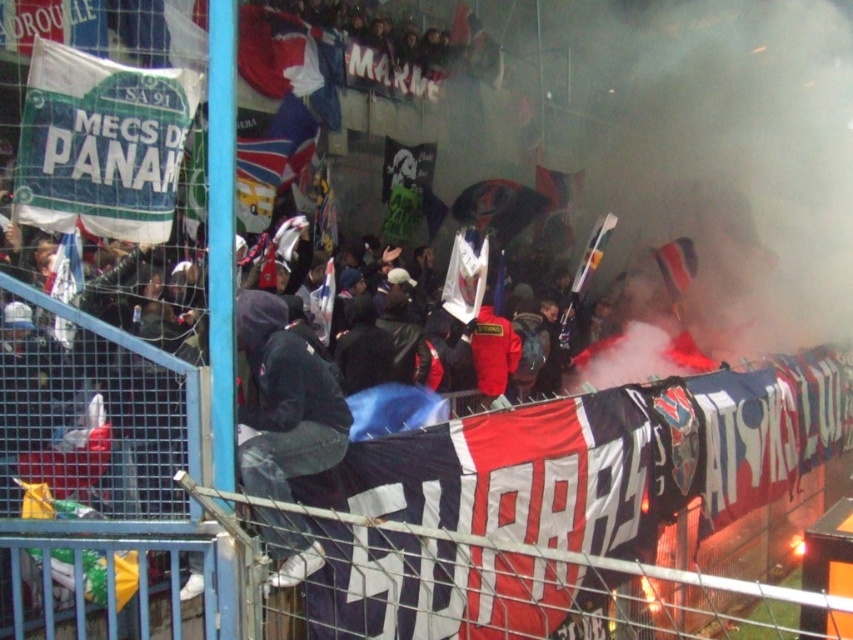
You are a photographer at the sports event. You want to capture a photo of the dark gray hoodie at center and the white fabric flag at left. Based on their positions, which object is closer to the camera?

The dark gray hoodie at center is closer to the camera because it is positioned below the white fabric flag at left, indicating it is in a lower plane relative to the camera.

Consider the image. You are a photographer trying to capture both the white paper flag at center and the white fabric flag at left. Which flag should you adjust your camera to focus on first if you want to include both in the frame without moving your position?

The white paper flag at center is positioned on the right side of white fabric flag at left, so you should focus on the white fabric flag at left first to ensure both flags are in the frame.